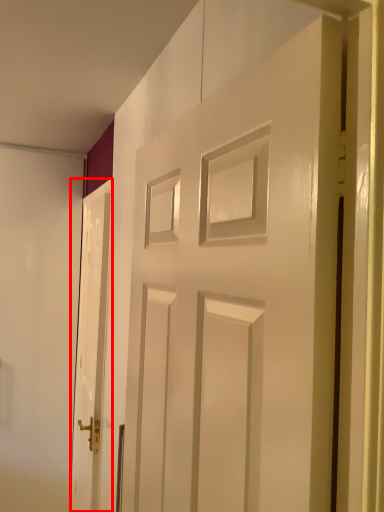
Question: From the image, what is the correct spatial relationship of door (annotated by the red box) in relation to door?

Choices:
 (A) right
 (B) left

Answer: (B)